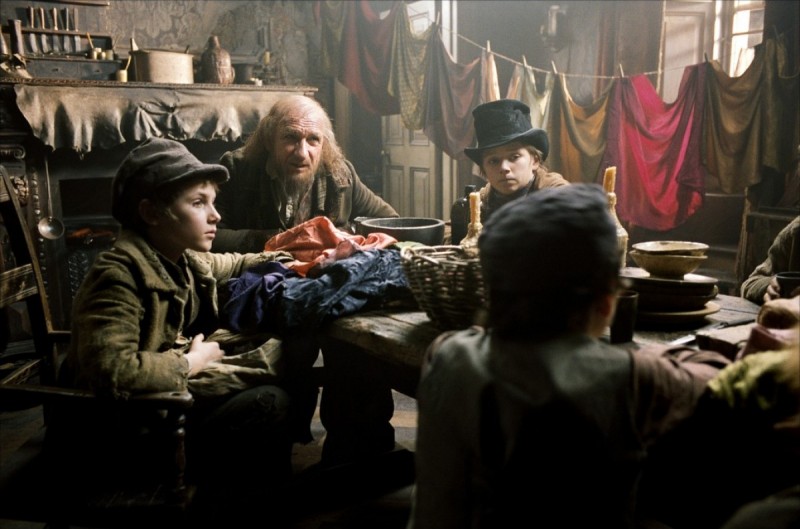
At what (x,y) coordinates should I click in order to perform the action: click on chair back. Please return your answer as a coordinate pair (x, y). The width and height of the screenshot is (800, 529). Looking at the image, I should click on (33, 269).